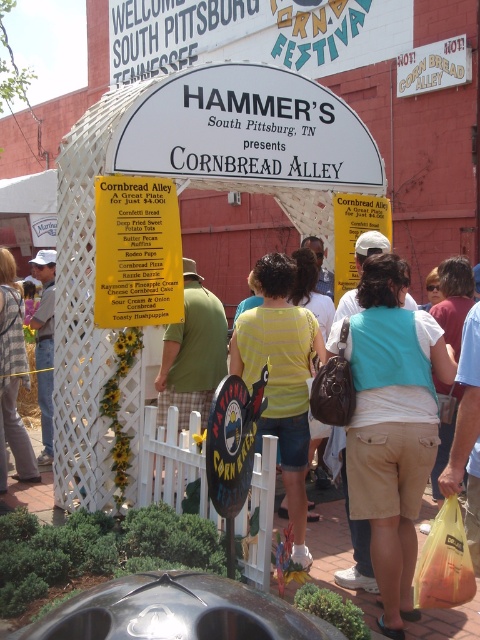
Does striped shirt at center appear over matte white hat at left?

Actually, striped shirt at center is below matte white hat at left.

Between point (6, 380) and point (50, 280), which one is positioned in front?

Positioned in front is point (6, 380).

The image size is (480, 640). Find the location of `striped shirt at center`. striped shirt at center is located at coordinates coord(12,376).

Locate an element on the screen. The image size is (480, 640). striped shirt at center is located at coordinates (12, 376).

Which is in front, point (119, 221) or point (46, 268)?

Positioned in front is point (119, 221).

Is yellow paper sign at center taller than matte white hat at left?

In fact, yellow paper sign at center may be shorter than matte white hat at left.

Between point (126, 275) and point (32, 326), which one is positioned behind?

The point (32, 326) is more distant.

Locate an element on the screen. yellow paper sign at center is located at coordinates (136, 252).

Does yellow paper sign at center have a greater height compared to striped shirt at center?

Incorrect, yellow paper sign at center's height is not larger of striped shirt at center's.

Is yellow paper sign at center to the right of striped shirt at center from the viewer's perspective?

Yes, yellow paper sign at center is to the right of striped shirt at center.

Which is in front, point (123, 188) or point (2, 490)?

Point (123, 188) is more forward.

I want to click on yellow paper sign at center, so click(x=136, y=252).